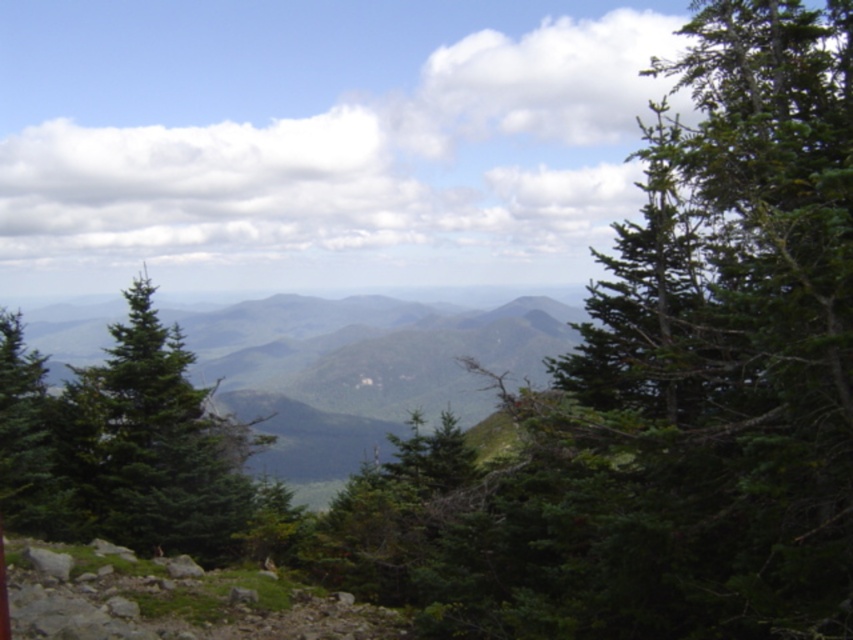
You are hiking in the mountain area and want to take a photo of the green matte tree at center and the green matte tree at left. Which tree is closer to the camera?

The green matte tree at center is positioned under the green matte tree at left, so the green matte tree at left is closer to the camera.

You are an environmental scientist assessing the growth patterns of trees in this mountainous area. You observe the green matte tree at center and the green matte tree at left. Which tree is taller?

The green matte tree at center is taller than the green matte tree at left.